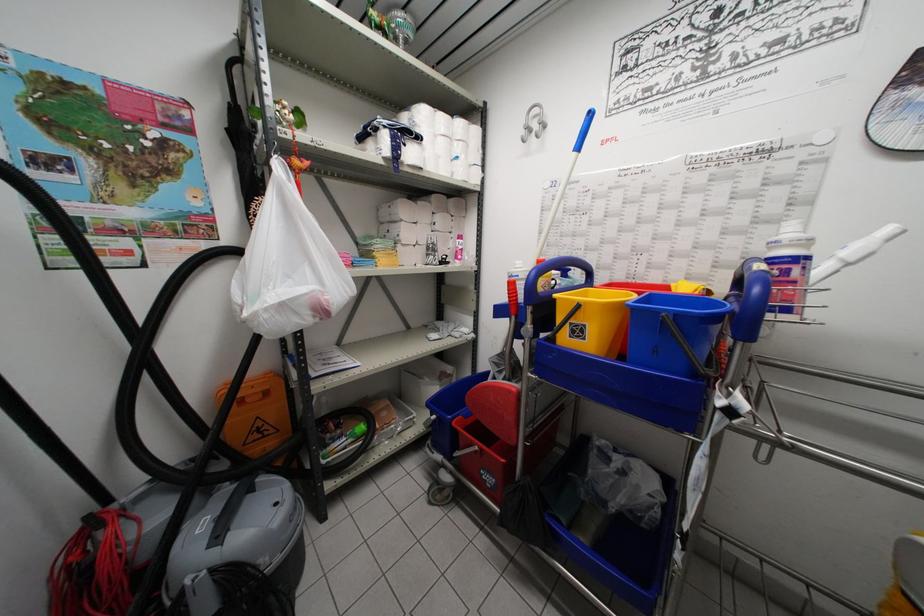
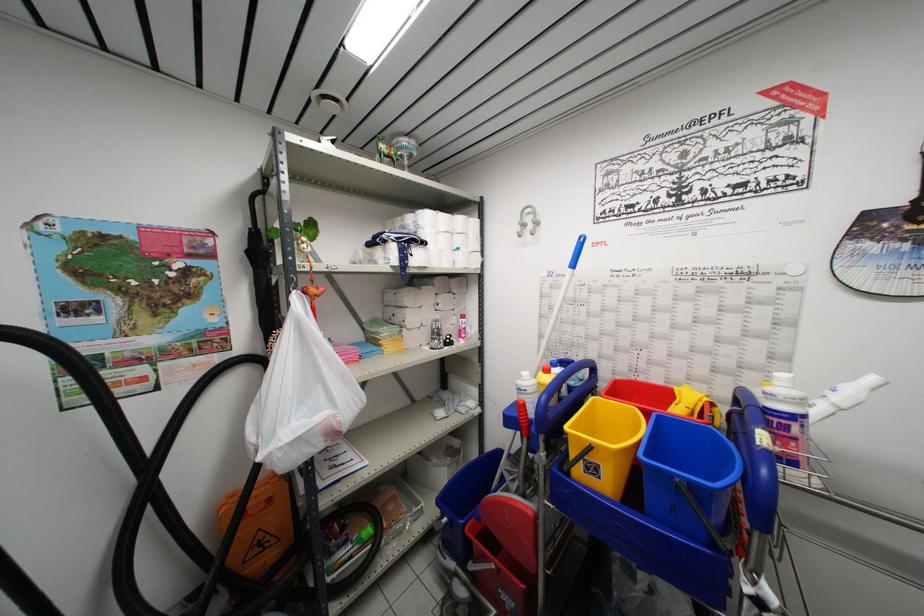
The point at [662,315] is marked in the first image. Where is the corresponding point in the second image?

(675, 479)